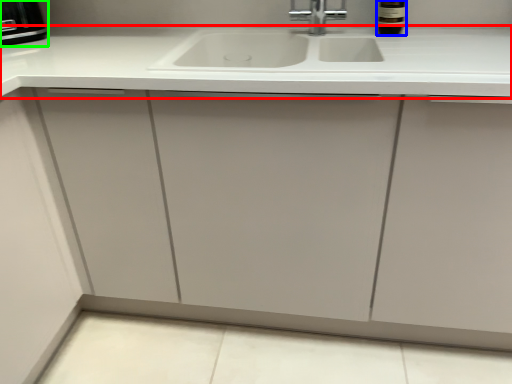
Question: Which is farther away from countertop (highlighted by a red box)? wine bottle (highlighted by a blue box) or appliance (highlighted by a green box)?

Choices:
 (A) wine bottle
 (B) appliance

Answer: (B)